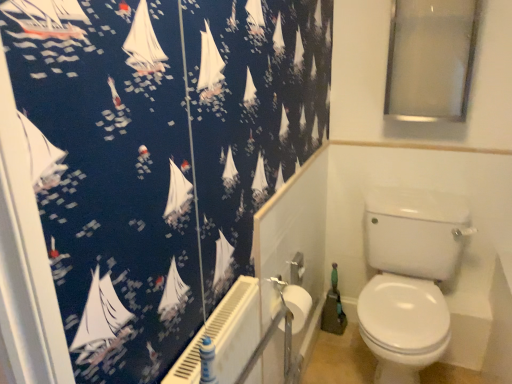
Question: Is white plastic radiator at lower center inside or outside of white glossy toilet at lower right?

Choices:
 (A) outside
 (B) inside

Answer: (A)

Question: Considering the positions of white plastic radiator at lower center and white glossy toilet at lower right in the image, is white plastic radiator at lower center taller or shorter than white glossy toilet at lower right?

Choices:
 (A) tall
 (B) short

Answer: (B)

Question: Which object is positioned farthest from the transparent glass window screen at upper right?

Choices:
 (A) white plastic radiator at lower center
 (B) white matte toilet paper at lower center
 (C) white glossy toilet at lower right
 (D) white glossy bidet at lower right

Answer: (A)

Question: Which object is positioned closest to the transparent glass window screen at upper right?

Choices:
 (A) white glossy bidet at lower right
 (B) white glossy toilet at lower right
 (C) white plastic radiator at lower center
 (D) white matte toilet paper at lower center

Answer: (B)